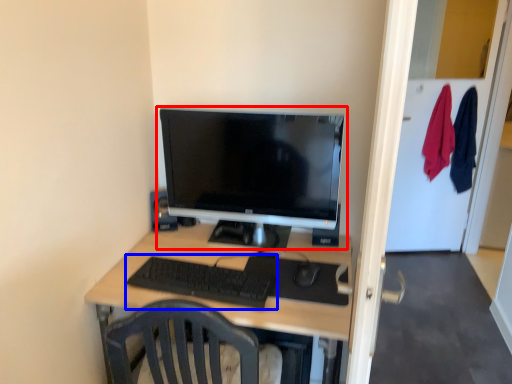
Question: Which object appears closest to the camera in this image, computer monitor (highlighted by a red box) or computer keyboard (highlighted by a blue box)?

Choices:
 (A) computer monitor
 (B) computer keyboard

Answer: (B)